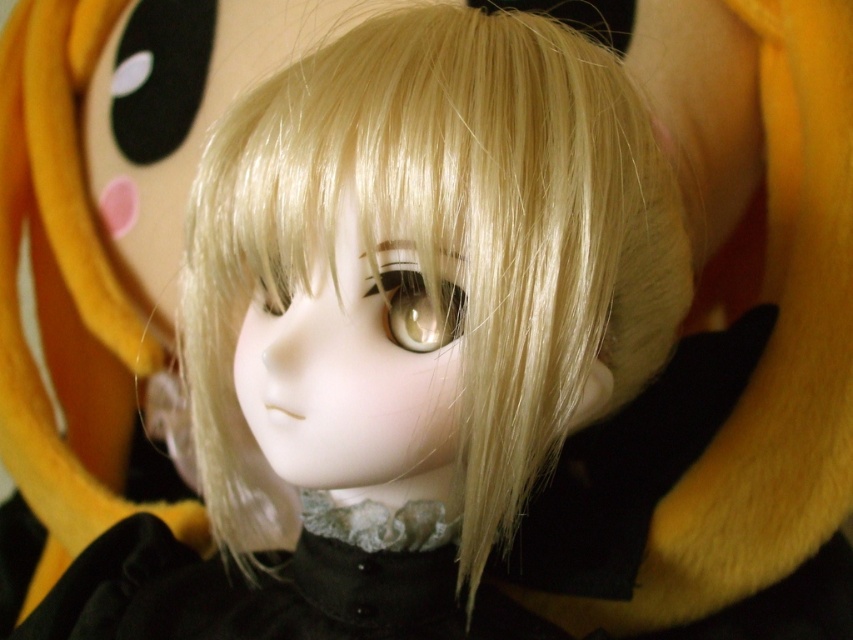
Identify the location of blonde silky hair at center. (415, 312).

Is the position of blonde silky hair at center less distant than that of soft yellow plush at upper left?

Yes, it is.

Consider the image. Who is more forward, (270, 536) or (91, 477)?

Point (270, 536) is more forward.

Locate an element on the screen. This screenshot has width=853, height=640. blonde silky hair at center is located at coordinates (415, 312).